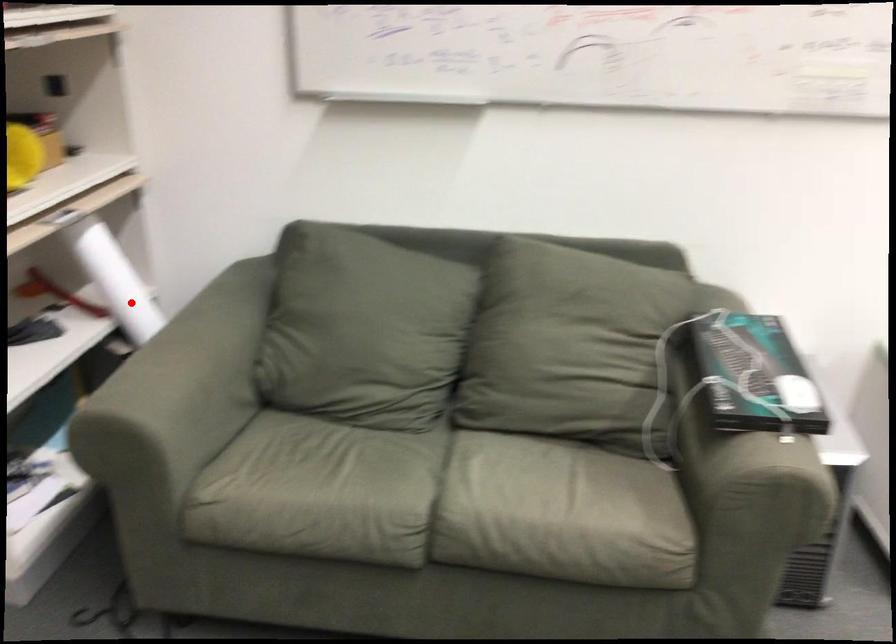
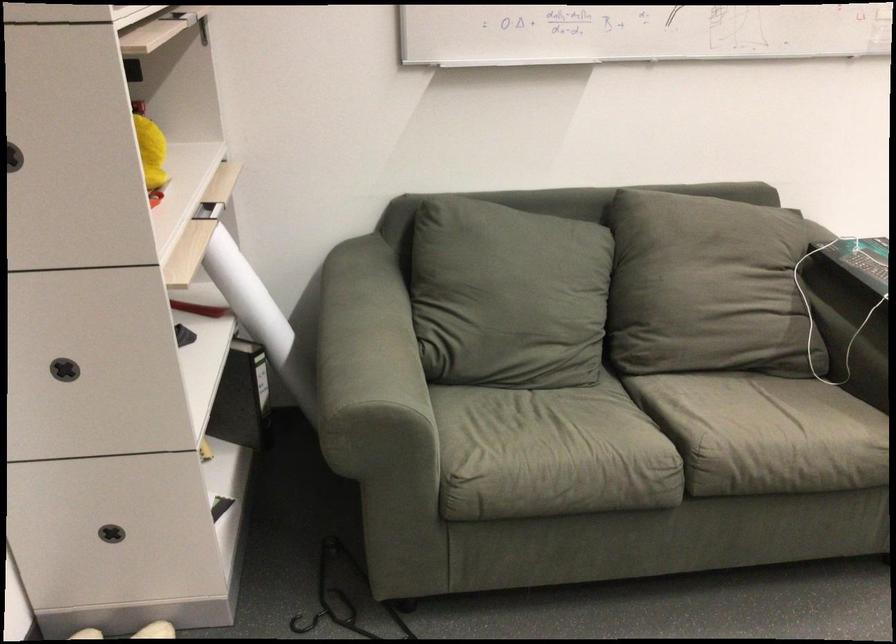
In the second image, find the point that corresponds to the highlighted location in the first image.

(247, 296)